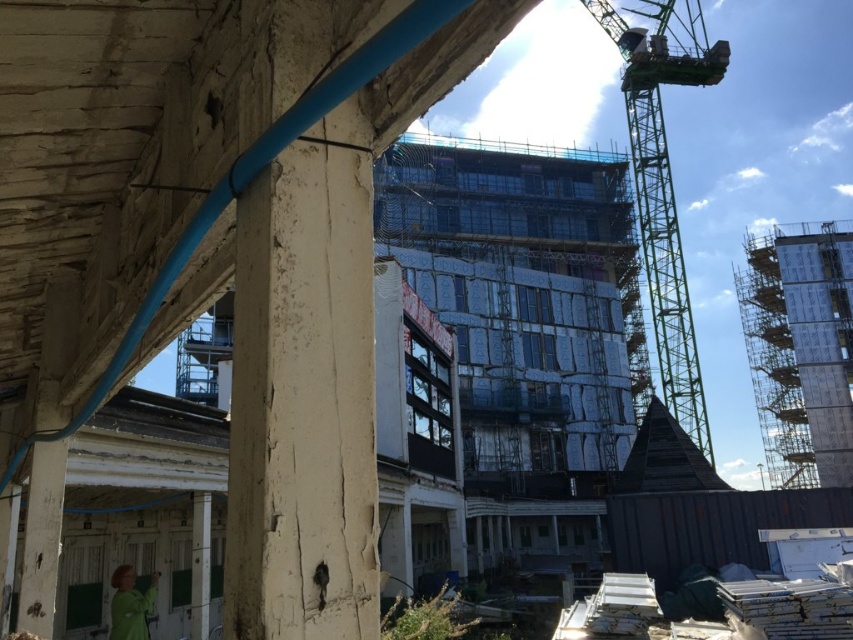
Question: Is green metallic crane at upper right thinner than green fabric construction worker at lower left?

Choices:
 (A) no
 (B) yes

Answer: (A)

Question: Is green metallic crane at upper right to the right of green fabric construction worker at lower left from the viewer's perspective?

Choices:
 (A) no
 (B) yes

Answer: (B)

Question: Among these points, which one is farthest from the camera?

Choices:
 (A) (119, 625)
 (B) (700, 26)

Answer: (B)

Question: Which point is farther to the camera?

Choices:
 (A) green metallic crane at upper right
 (B) green fabric construction worker at lower left

Answer: (A)

Question: Is green metallic crane at upper right positioned behind green fabric construction worker at lower left?

Choices:
 (A) no
 (B) yes

Answer: (B)